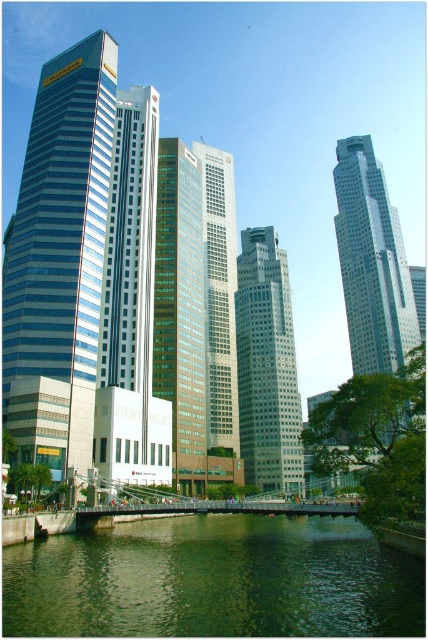
Is gray glass skyscraper at center to the right of glassy silver skyscraper at center from the viewer's perspective?

Yes, gray glass skyscraper at center is to the right of glassy silver skyscraper at center.

What do you see at coordinates (267, 365) in the screenshot? I see `gray glass skyscraper at center` at bounding box center [267, 365].

Between point (273, 285) and point (204, 152), which one is positioned behind?

The point (204, 152) is behind.

Image resolution: width=428 pixels, height=640 pixels. I want to click on gray glass skyscraper at center, so click(267, 365).

Between point (64, 380) and point (341, 161), which one is positioned behind?

Point (341, 161)

Who is positioned more to the right, shiny glass skyscraper at left or glassy white skyscraper at center?

glassy white skyscraper at center is more to the right.

The width and height of the screenshot is (428, 640). Describe the element at coordinates (59, 257) in the screenshot. I see `shiny glass skyscraper at left` at that location.

At what (x,y) coordinates should I click in order to perform the action: click on shiny glass skyscraper at left. Please return your answer as a coordinate pair (x, y). Image resolution: width=428 pixels, height=640 pixels. Looking at the image, I should click on (59, 257).

Who is more forward, (12,579) or (267,376)?

Point (12,579) is more forward.

Is green liquid water at lower center wider than gray glass skyscraper at center?

Indeed, green liquid water at lower center has a greater width compared to gray glass skyscraper at center.

Does point (44, 611) lie in front of point (285, 307)?

Yes, it is in front of point (285, 307).

At what (x,y) coordinates should I click in order to perform the action: click on green liquid water at lower center. Please return your answer as a coordinate pair (x, y). Looking at the image, I should click on (214, 580).